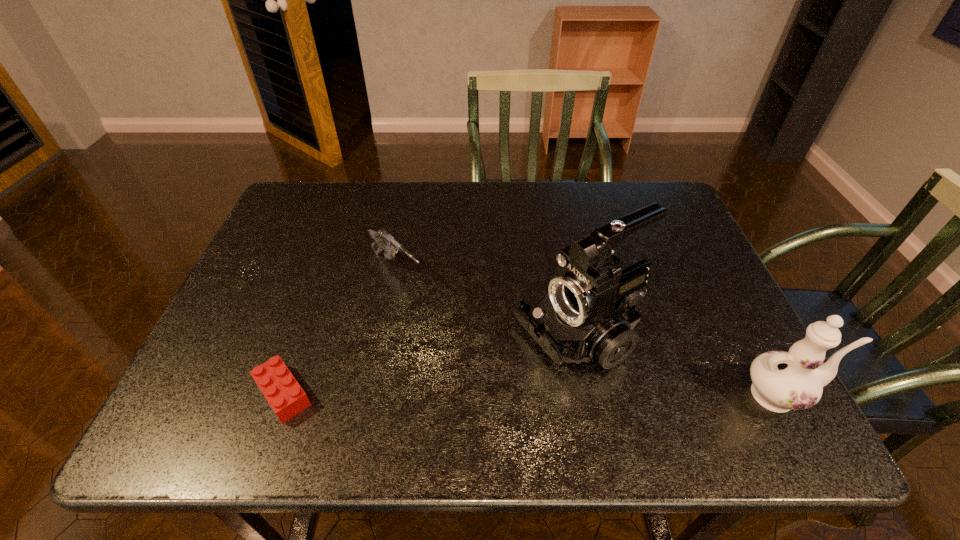
The height and width of the screenshot is (540, 960). I want to click on object situated at the near left corner, so click(x=284, y=394).

The image size is (960, 540). Identify the location of object at the near right corner. (782, 381).

I want to click on free location at the far edge of the desktop, so click(584, 207).

The width and height of the screenshot is (960, 540). I want to click on free space at the near edge of the desktop, so click(403, 390).

You are a GUI agent. You are given a task and a screenshot of the screen. Output one action in this format:
    pyautogui.click(x=<x>, y=<y>)
    Task: Click on the free region at the left edge of the desktop
    The width and height of the screenshot is (960, 540).
    Given the screenshot: What is the action you would take?
    pyautogui.click(x=226, y=327)

Where is `free spot at the right edge of the desktop`? The width and height of the screenshot is (960, 540). free spot at the right edge of the desktop is located at coordinates (676, 316).

Where is `blank space at the near left corner`? blank space at the near left corner is located at coordinates (252, 363).

Locate an element on the screen. The image size is (960, 540). free space at the far right corner is located at coordinates click(644, 228).

I want to click on free space that is in between the third shortest object and the tallest object, so click(678, 365).

This screenshot has width=960, height=540. What are the coordinates of `vacant space that's between the tallest object and the leftmost object` in the screenshot? It's located at (429, 364).